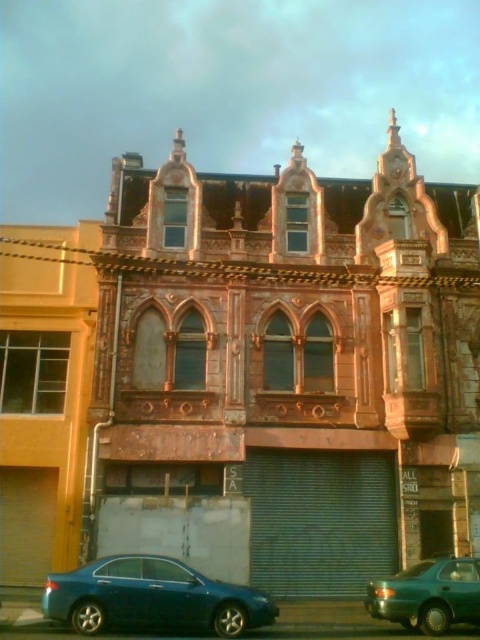
Question: Can you confirm if matte blue sedan at lower left is wider than teal glossy sedan at lower right?

Choices:
 (A) no
 (B) yes

Answer: (B)

Question: Which point is closer to the camera?

Choices:
 (A) matte blue sedan at lower left
 (B) teal glossy sedan at lower right

Answer: (A)

Question: Is matte blue sedan at lower left smaller than teal glossy sedan at lower right?

Choices:
 (A) yes
 (B) no

Answer: (B)

Question: Among these points, which one is farthest from the camera?

Choices:
 (A) (84, 627)
 (B) (385, 589)

Answer: (B)

Question: Which point is closer to the camera?

Choices:
 (A) teal glossy sedan at lower right
 (B) matte blue sedan at lower left

Answer: (B)

Question: Can you confirm if matte blue sedan at lower left is positioned to the right of teal glossy sedan at lower right?

Choices:
 (A) yes
 (B) no

Answer: (B)